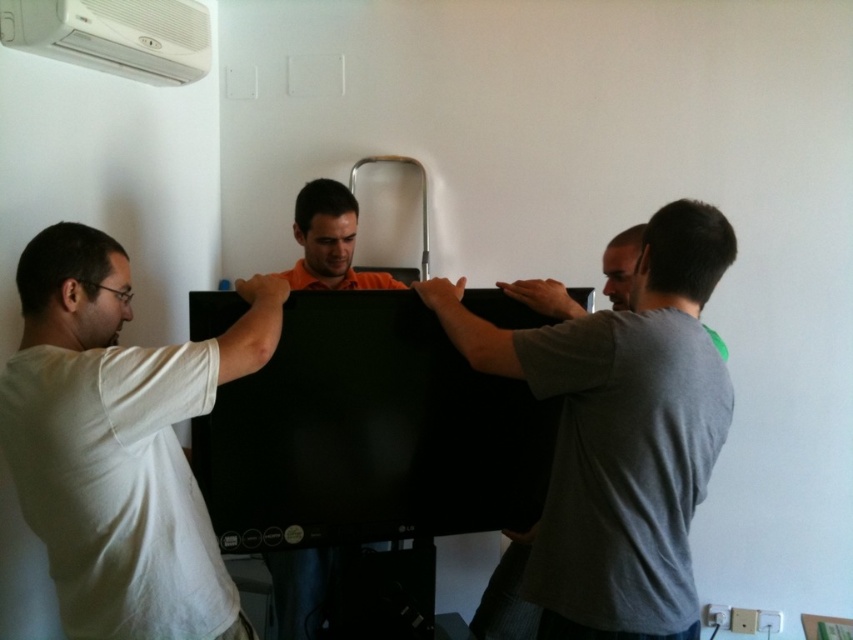
Can you confirm if white plastic air conditioning unit at upper left is shorter than orange matte shirt at center?

No, white plastic air conditioning unit at upper left is not shorter than orange matte shirt at center.

The width and height of the screenshot is (853, 640). I want to click on white plastic air conditioning unit at upper left, so click(x=114, y=35).

Find the location of a particular element. The width and height of the screenshot is (853, 640). white plastic air conditioning unit at upper left is located at coordinates (114, 35).

Which is below, gray matte shirt at right or orange matte shirt at center?

gray matte shirt at right

Can you confirm if gray matte shirt at right is smaller than orange matte shirt at center?

No, gray matte shirt at right is not smaller than orange matte shirt at center.

Which is behind, point (596, 509) or point (300, 264)?

Positioned behind is point (300, 264).

Locate an element on the screen. This screenshot has height=640, width=853. gray matte shirt at right is located at coordinates (621, 433).

Between gray matte shirt at right and white plastic air conditioning unit at upper left, which one appears on the right side from the viewer's perspective?

Positioned to the right is gray matte shirt at right.

Who is more forward, (688,272) or (90,12)?

Point (688,272) is more forward.

The height and width of the screenshot is (640, 853). Describe the element at coordinates (621, 433) in the screenshot. I see `gray matte shirt at right` at that location.

This screenshot has width=853, height=640. I want to click on gray matte shirt at right, so click(x=621, y=433).